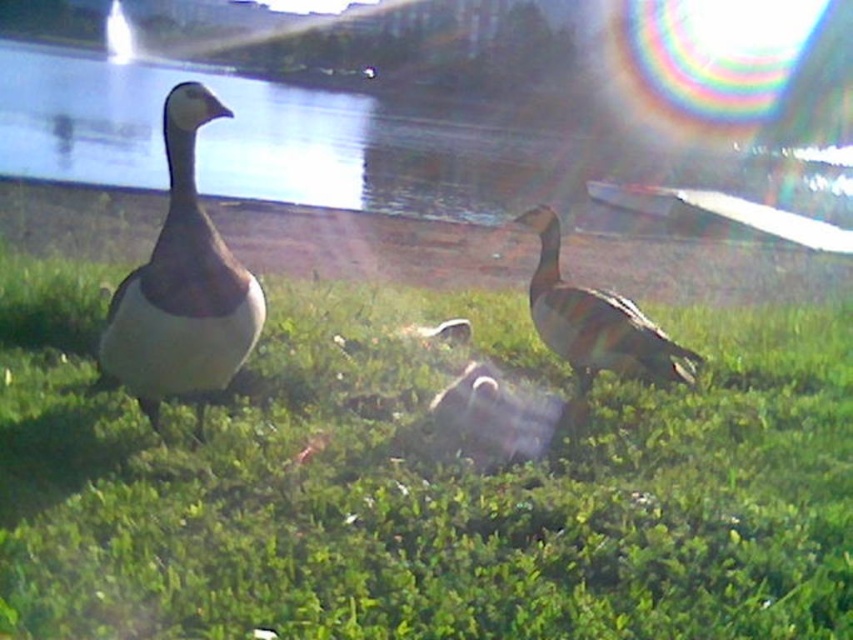
Question: Among these objects, which one is farthest from the camera?

Choices:
 (A) green grassy at center
 (B) transparent glass water at center
 (C) brown striped duck at center

Answer: (C)

Question: Among these objects, which one is nearest to the camera?

Choices:
 (A) brown striped duck at center
 (B) white matte duck at left

Answer: (B)

Question: Does green grassy at center have a lesser width compared to white matte duck at left?

Choices:
 (A) yes
 (B) no

Answer: (B)

Question: Does green grassy at center come behind transparent glass water at center?

Choices:
 (A) no
 (B) yes

Answer: (A)

Question: Which point is closer to the camera?

Choices:
 (A) (573, 333)
 (B) (175, 104)
 (C) (535, 177)

Answer: (B)

Question: Is green grassy at center wider than transparent glass water at center?

Choices:
 (A) yes
 (B) no

Answer: (B)